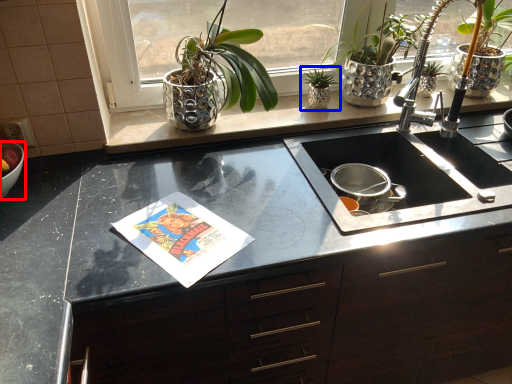
Question: Which object is further to the camera taking this photo, mixing bowl (highlighted by a red box) or houseplant (highlighted by a blue box)?

Choices:
 (A) mixing bowl
 (B) houseplant

Answer: (B)